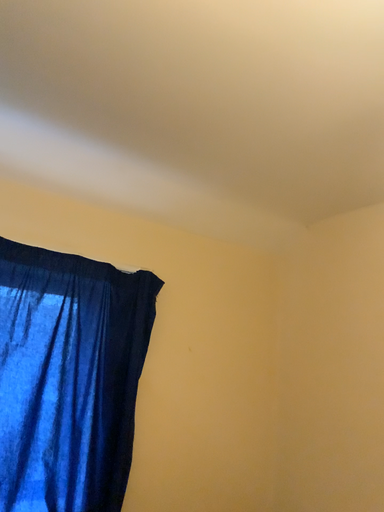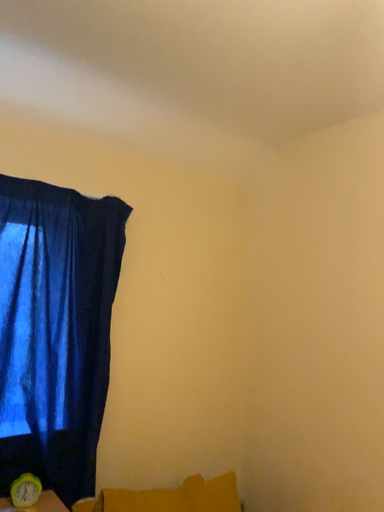
Question: Which way did the camera rotate in the video?

Choices:
 (A) rotated upward
 (B) rotated downward

Answer: (B)